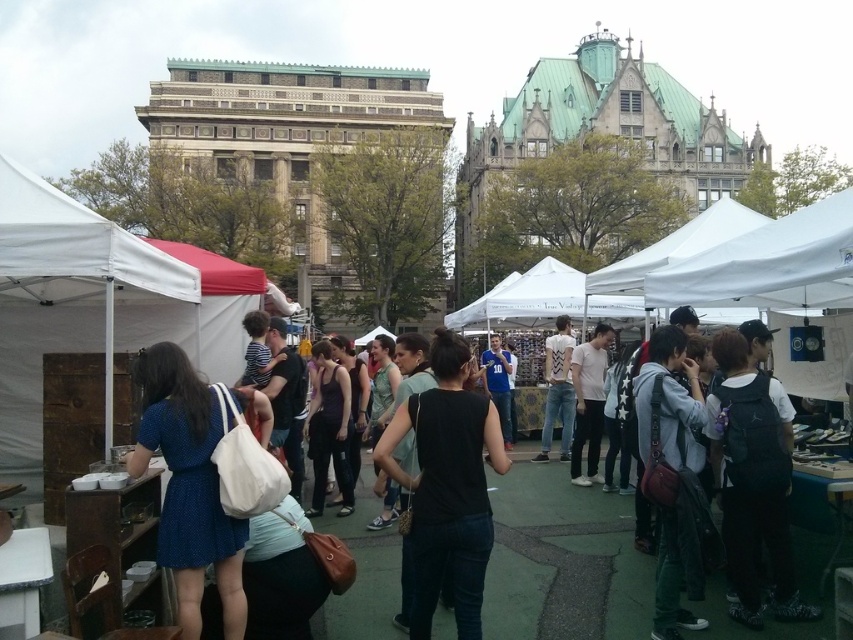
Does white fabric canopy at upper right have a lesser width compared to white matte shirt at center?

In fact, white fabric canopy at upper right might be wider than white matte shirt at center.

Find the location of `white fabric canopy at upper right`. white fabric canopy at upper right is located at coordinates (769, 264).

Between blue dotted dress at center and white matte t-shirt at center, which one is positioned higher?

white matte t-shirt at center is above.

The height and width of the screenshot is (640, 853). I want to click on blue dotted dress at center, so click(189, 486).

Describe the element at coordinates (189, 486) in the screenshot. I see `blue dotted dress at center` at that location.

Find the location of `blue dotted dress at center`. blue dotted dress at center is located at coordinates (189, 486).

Image resolution: width=853 pixels, height=640 pixels. Describe the element at coordinates (189, 486) in the screenshot. I see `blue dotted dress at center` at that location.

Looking at this image, between blue dotted dress at center and blue jersey at center, which one is positioned lower?

blue dotted dress at center

Does point (195, 557) lie behind point (503, 404)?

That is False.

Where is `blue dotted dress at center`? This screenshot has width=853, height=640. blue dotted dress at center is located at coordinates (189, 486).